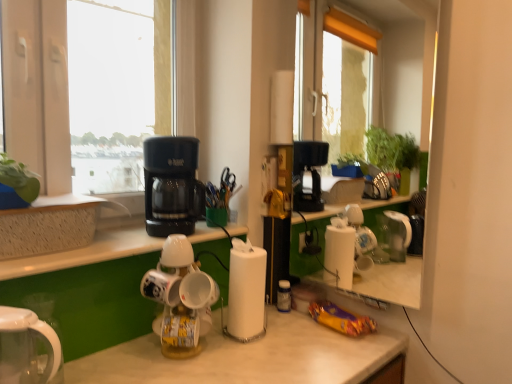
What do you see at coordinates (37, 89) in the screenshot?
I see `transparent glass window at upper left` at bounding box center [37, 89].

Describe the element at coordinates (19, 179) in the screenshot. This screenshot has height=384, width=512. I see `green leafy plant at upper left` at that location.

The width and height of the screenshot is (512, 384). Find the location of `white glossy mug at center, which is the first mug in right-to-left order`. white glossy mug at center, which is the first mug in right-to-left order is located at coordinates (198, 290).

This screenshot has height=384, width=512. What are the coordinates of `white paper at center` in the screenshot? It's located at (246, 291).

Is white glossy mug rack at center, the 2th kitchen appliance from the top, inside transparent glass mirror at upper center?

Definitely not — white glossy mug rack at center, the 2th kitchen appliance from the top, is not inside transparent glass mirror at upper center.

Can you confirm if transparent glass mirror at upper center is taller than white glossy mug rack at center, the 2th kitchen appliance from the top?

Indeed, transparent glass mirror at upper center has a greater height compared to white glossy mug rack at center, the 2th kitchen appliance from the top.

Does transparent glass mirror at upper center appear on the left side of white glossy mug rack at center, the 2th kitchen appliance from the top?

No.

From a real-world perspective, who is located lower, transparent glass mirror at upper center or white glossy mug rack at center, positioned as the first kitchen appliance in bottom-to-top order?

In real-world perspective, white glossy mug rack at center, positioned as the first kitchen appliance in bottom-to-top order, is lower.

Between white matte cup at center and textured concrete at left, which one has smaller size?

white matte cup at center.

Considering the positions of point (143, 234) and point (56, 217), is point (143, 234) closer or farther from the camera than point (56, 217)?

Point (143, 234) appears to be farther away from the viewer than point (56, 217).

Can you confirm if white matte cup at center is thinner than textured concrete at left?

Incorrect, the width of white matte cup at center is not less than that of textured concrete at left.

Find the location of `countertop below the textured concrete at left (from the image's perspective)`. countertop below the textured concrete at left (from the image's perspective) is located at coordinates (85, 253).

From a real-world perspective, does translucent plastic bottle at center sit lower than white glossy kettle at lower left?

Yes, from a real-world perspective, translucent plastic bottle at center is below white glossy kettle at lower left.

What's the angular difference between translucent plastic bottle at center and white glossy kettle at lower left's facing directions?

They differ by 121 degrees in their facing directions.

Where is `home appliance above the translucent plastic bottle at center (from a real-world perspective)`? The height and width of the screenshot is (384, 512). home appliance above the translucent plastic bottle at center (from a real-world perspective) is located at coordinates (26, 347).

Between translucent plastic bottle at center and white glossy kettle at lower left, which one has larger size?

Bigger between the two is white glossy kettle at lower left.

Who is taller, white glossy kettle at lower left or white glossy mug at center, the second mug when ordered from right to left?

Standing taller between the two is white glossy kettle at lower left.

Based on the photo, could you measure the distance between white glossy kettle at lower left and white glossy mug at center, arranged as the first mug when viewed from the left?

white glossy kettle at lower left is 13.41 inches from white glossy mug at center, arranged as the first mug when viewed from the left.

Considering the positions of objects white glossy kettle at lower left and white glossy mug at center, arranged as the first mug when viewed from the left, in the image provided, who is more to the right, white glossy kettle at lower left or white glossy mug at center, arranged as the first mug when viewed from the left,?

Positioned to the right is white glossy mug at center, arranged as the first mug when viewed from the left.

Considering the sizes of objects white glossy kettle at lower left and white glossy mug at center, the second mug when ordered from right to left, in the image provided, who is thinner, white glossy kettle at lower left or white glossy mug at center, the second mug when ordered from right to left,?

With smaller width is white glossy mug at center, the second mug when ordered from right to left.

Based on their sizes in the image, would you say transparent glass mirror at upper center is bigger or smaller than white matte cup at center?

Clearly, transparent glass mirror at upper center is larger in size than white matte cup at center.

Measure the distance between transparent glass mirror at upper center and white matte cup at center.

transparent glass mirror at upper center and white matte cup at center are 6.57 feet apart from each other.

Are transparent glass mirror at upper center and white matte cup at center far apart?

That's right, there is a large distance between transparent glass mirror at upper center and white matte cup at center.

From a real-world perspective, is transparent glass mirror at upper center physically above white matte cup at center?

Yes, from a real-world perspective, transparent glass mirror at upper center is over white matte cup at center

Considering their positions, is textured concrete at left located in front of or behind white matte cup at center?

textured concrete at left is behind white matte cup at center.

From a real-world perspective, does textured concrete at left sit lower than white matte cup at center?

Incorrect, from a real-world perspective, textured concrete at left is higher than white matte cup at center.

Where is `window sill that is behind the white matte cup at center`? Image resolution: width=512 pixels, height=384 pixels. window sill that is behind the white matte cup at center is located at coordinates (49, 226).

In the image, is translucent plastic bottle at center positioned in front of or behind white glossy mug rack at center, positioned as the first kitchen appliance in bottom-to-top order?

Visually, translucent plastic bottle at center is located behind white glossy mug rack at center, positioned as the first kitchen appliance in bottom-to-top order.

In order to click on the 2nd kitchen appliance in front of the translucent plastic bottle at center in this screenshot , I will do `click(180, 299)`.

Measure the distance between translucent plastic bottle at center and white glossy mug rack at center, positioned as the first kitchen appliance in bottom-to-top order.

They are 46.05 centimeters apart.

In the scene shown: Looking at their sizes, would you say translucent plastic bottle at center is wider or thinner than white glossy mug rack at center, the 2th kitchen appliance from the top?

translucent plastic bottle at center is thinner than white glossy mug rack at center, the 2th kitchen appliance from the top.

Locate an element on the screen. This screenshot has width=512, height=384. kitchen appliance that is in front of the transparent glass mirror at upper center is located at coordinates (180, 299).

This screenshot has width=512, height=384. Identify the location of countertop located on the right of textured concrete at left. (85, 253).

From the image, which object appears to be nearer to transparent glass window at upper left, black plastic coffee maker at upper left, which is the second kitchen appliance in bottom-to-top order, or white glossy mug rack at center, the 2th kitchen appliance from the top?

black plastic coffee maker at upper left, which is the second kitchen appliance in bottom-to-top order.

Looking at the image, which one is located further to white glossy mug at center, the second mug when ordered from right to left, transparent glass window at upper left or white glossy mug rack at center, positioned as the first kitchen appliance in bottom-to-top order?

The object further to white glossy mug at center, the second mug when ordered from right to left, is transparent glass window at upper left.

Considering their positions, is white glossy mug rack at center, positioned as the first kitchen appliance in bottom-to-top order, positioned further to green leafy plant at upper left than white glossy kettle at lower left?

The object further to green leafy plant at upper left is white glossy mug rack at center, positioned as the first kitchen appliance in bottom-to-top order.

When comparing their distances from white glossy kettle at lower left, does green leafy plant at upper left or textured concrete at left seem further?

The object further to white glossy kettle at lower left is green leafy plant at upper left.

Which object lies further to the anchor point white glossy mug at center, the second mug when ordered from right to left, green leafy plant at upper left or transparent glass mirror at upper center?

transparent glass mirror at upper center.

Which object lies nearer to the anchor point white glossy mug rack at center, the 2th kitchen appliance from the top, white glossy mug at center, the second mug when ordered from right to left, or textured concrete at left?

white glossy mug at center, the second mug when ordered from right to left, is closer to white glossy mug rack at center, the 2th kitchen appliance from the top.

Which object lies further to the anchor point transparent glass window at upper left, translucent plastic bottle at center or white glossy mug at center, arranged as the first mug when viewed from the left?

translucent plastic bottle at center is further to transparent glass window at upper left.

Based on their spatial positions, is transparent glass window at upper left or white paper at center closer to textured concrete at left?

transparent glass window at upper left is closer to textured concrete at left.

Where is `bottle located between green leafy plant at upper left and transparent glass mirror at upper center in the left-right direction`? bottle located between green leafy plant at upper left and transparent glass mirror at upper center in the left-right direction is located at coordinates (284, 296).

Where is `kitchen appliance located between green leafy plant at upper left and white glossy mug at center, the second mug when ordered from right to left, in the left-right direction`? This screenshot has width=512, height=384. kitchen appliance located between green leafy plant at upper left and white glossy mug at center, the second mug when ordered from right to left, in the left-right direction is located at coordinates (172, 185).

I want to click on paper towel between textured concrete at left and translucent plastic bottle at center from left to right, so click(x=246, y=291).

Where is `home appliance situated between textured concrete at left and white glossy mug rack at center, positioned as the first kitchen appliance in bottom-to-top order, from left to right`? The height and width of the screenshot is (384, 512). home appliance situated between textured concrete at left and white glossy mug rack at center, positioned as the first kitchen appliance in bottom-to-top order, from left to right is located at coordinates (26, 347).